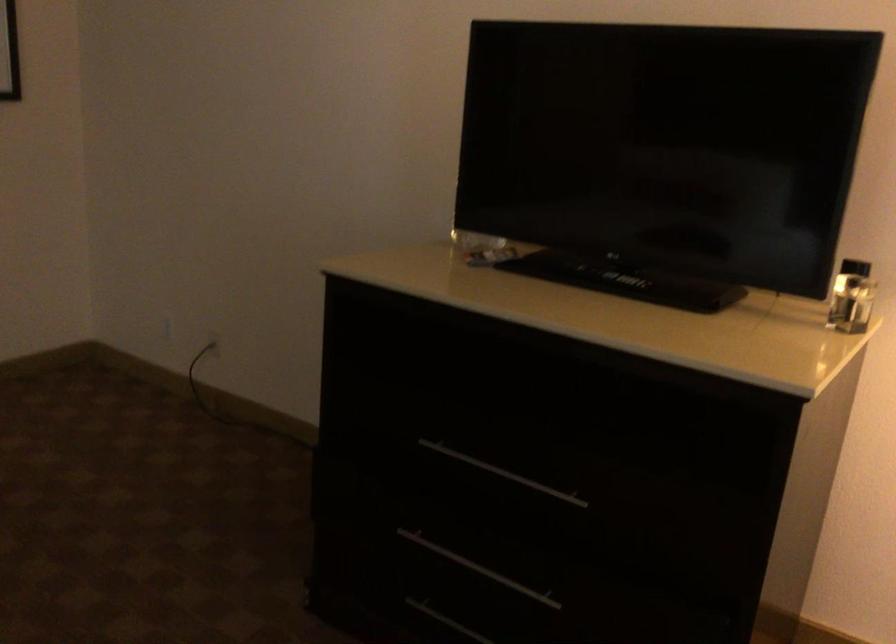
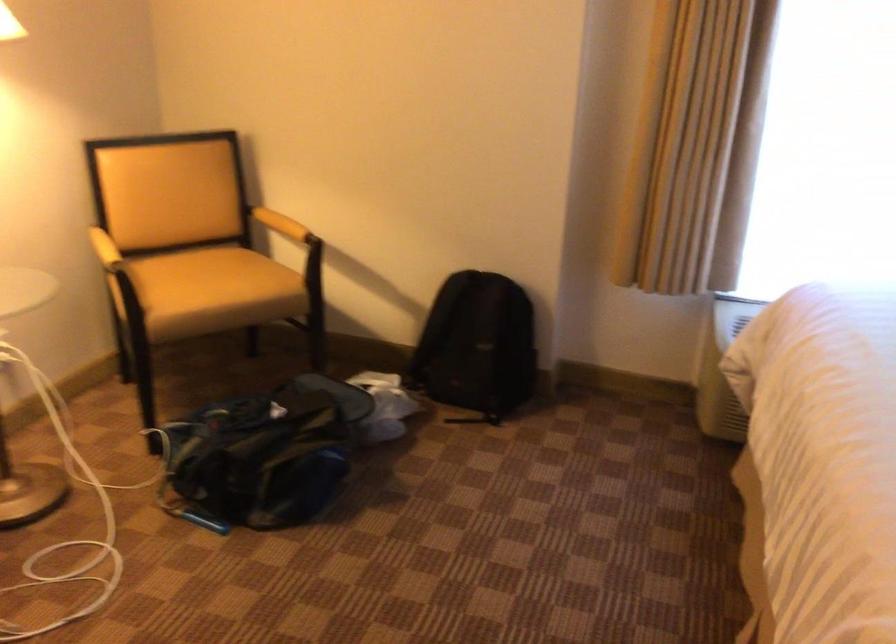
First-person continuous shooting, in which direction is the camera rotating?

The rotation direction of the camera is right-down.